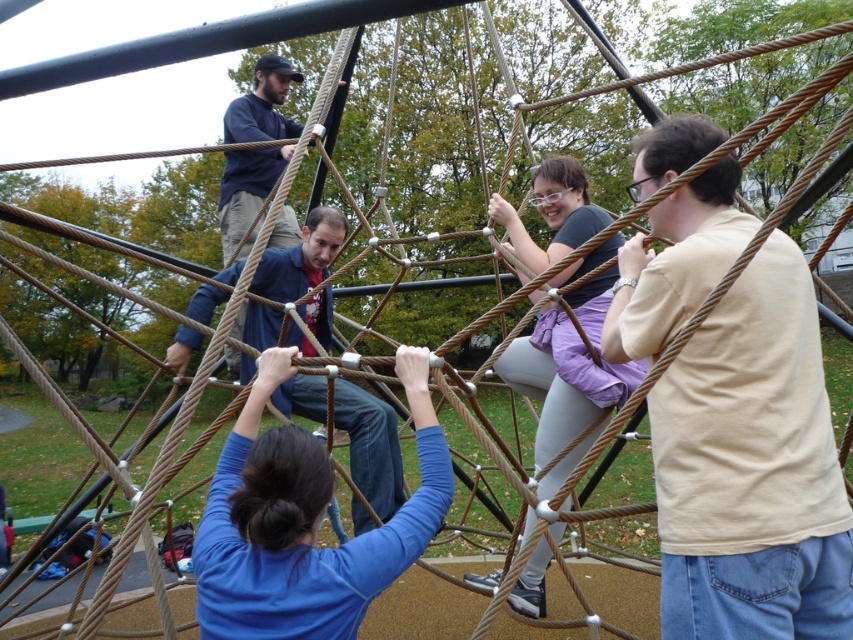
You are a photographer trying to capture the scene of the climbing activity. You notice the blue denim jeans at center and the dark blue sweater at upper center. Which clothing item would appear bigger in your photo?

The blue denim jeans at center would appear bigger in the photo because it has a larger size compared to the dark blue sweater at upper center.

You are standing at the base of the rope climbing structure and see the beige cotton shirt at upper right and the matte purple pants at center. Which clothing item is higher up in the structure?

The beige cotton shirt at upper right is positioned over the matte purple pants at center, so it is higher up in the structure.